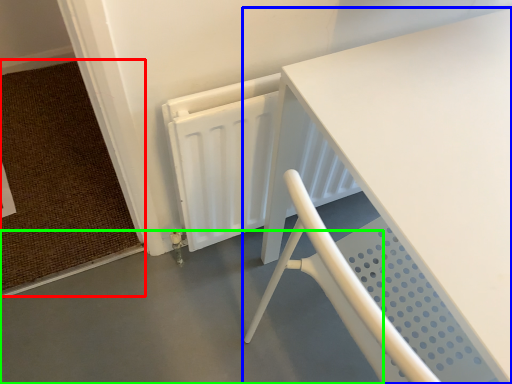
Question: Which object is positioned farthest from doormat (highlighted by a red box)? Select from table (highlighted by a blue box) and concrete (highlighted by a green box).

Choices:
 (A) table
 (B) concrete

Answer: (A)